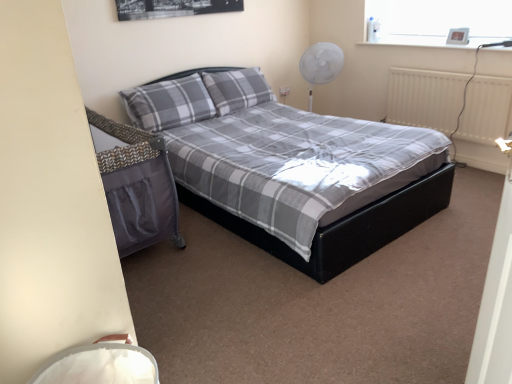
Locate an element on the screen. This screenshot has width=512, height=384. vacant space to the left of metallic digital clock at upper right is located at coordinates (443, 46).